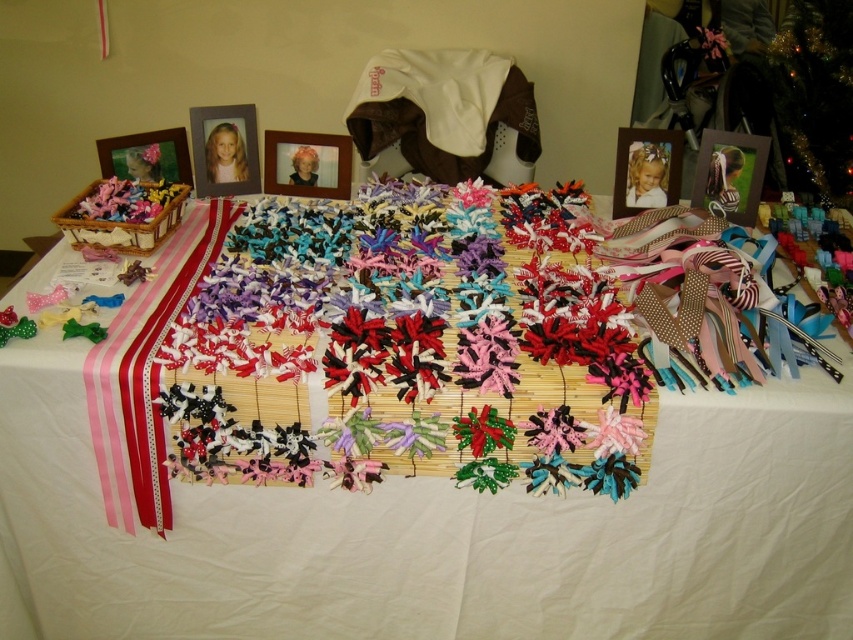
Question: Among these objects, which one is nearest to the camera?

Choices:
 (A) matte wooden picture frame at upper left
 (B) wooden photo frame at upper right
 (C) matte plastic picture frame at upper left

Answer: (A)

Question: Among these objects, which one is farthest from the camera?

Choices:
 (A) white fabric at center
 (B) wooden photo frame at upper center
 (C) blonde hair doll at center
 (D) multicolored fabric bows at center

Answer: (C)

Question: Observing the image, what is the correct spatial positioning of wooden photo frame at upper right in reference to matte wooden picture frame at upper left?

Choices:
 (A) below
 (B) above

Answer: (A)

Question: Where is wooden photo frame at center located in relation to blonde hair doll at center in the image?

Choices:
 (A) below
 (B) above

Answer: (B)

Question: Does wooden photo frame at upper right have a lesser width compared to matte wooden picture frame at upper left?

Choices:
 (A) yes
 (B) no

Answer: (A)

Question: Based on their relative distances, which object is nearer to the matte wooden picture frame at upper left?

Choices:
 (A) wooden photo frame at upper right
 (B) wooden photo frame at center
 (C) wooden photo frame at upper center

Answer: (B)